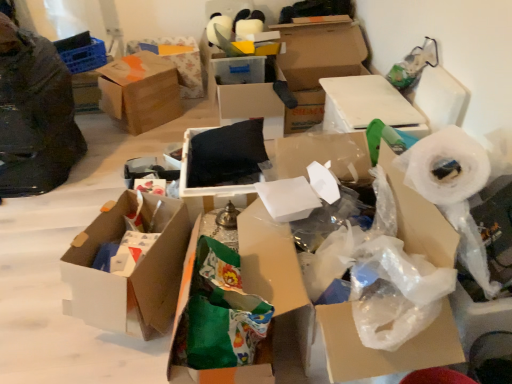
Question: Looking at their shapes, would you say white plastic bag at center, the eighth box in the left-to-right sequence, is wider or thinner than brown cardboard box at upper center, marked as the 2th box in a left-to-right arrangement?

Choices:
 (A) wide
 (B) thin

Answer: (B)

Question: Looking at the image, does white plastic bag at center, the first box in the right-to-left sequence, seem bigger or smaller compared to brown cardboard box at upper center, marked as the 2th box in a left-to-right arrangement?

Choices:
 (A) big
 (B) small

Answer: (A)

Question: Which object is the closest to the black matte pillow at center, the 5th box from the right?

Choices:
 (A) white plastic bag at center, the eighth box in the left-to-right sequence
 (B) white plastic roll at right
 (C) cardboard box at upper center, which ranks as the second box in right-to-left order
 (D) white cardboard box at center, which is counted as the third box, starting from the left
 (E) dark green fabric at left

Answer: (D)

Question: Which object is the farthest from the green fabric bag at center, acting as the 5th box starting from the left?

Choices:
 (A) cardboard box at center
 (B) brown cardboard box at upper left, placed as the 1th box when sorted from left to right
 (C) cardboard box at upper center, arranged as the 7th box when viewed from the left
 (D) black matte pillow at center, the 5th box from the right
 (E) white cardboard box at center, positioned as the 6th box in right-to-left order

Answer: (B)